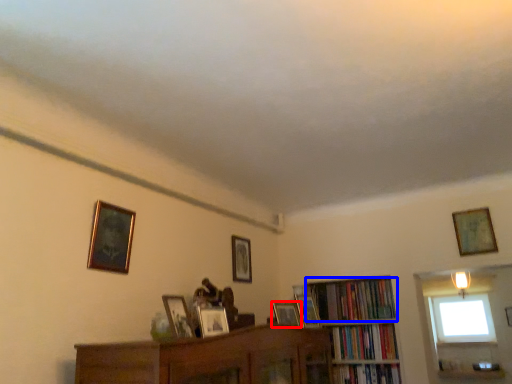
Question: Among these objects, which one is nearest to the camera, picture frame (highlighted by a red box) or book (highlighted by a blue box)?

Choices:
 (A) picture frame
 (B) book

Answer: (A)